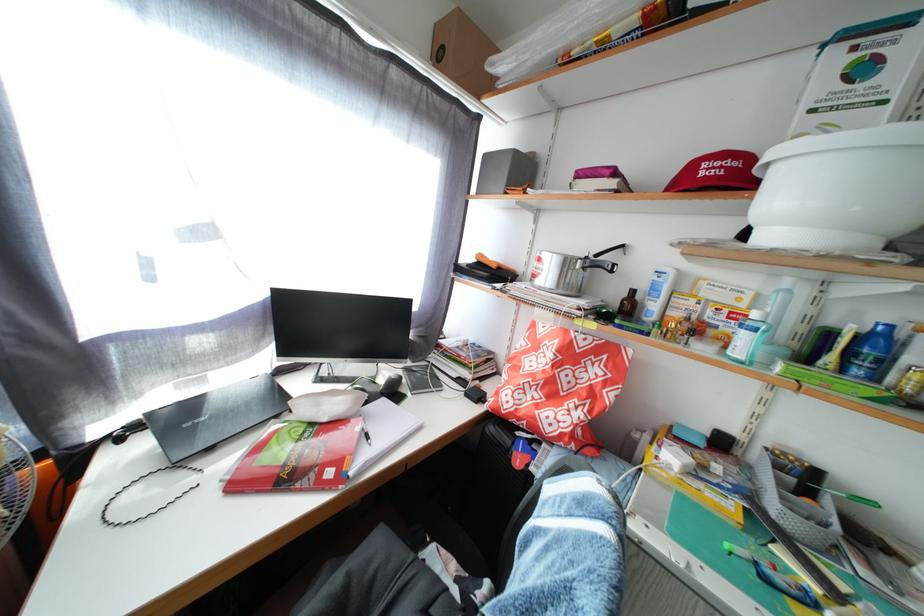
The location [560,384] corresponds to which object?

It refers to a orange shopping bag.